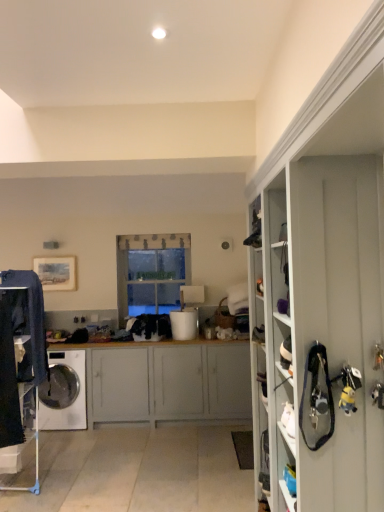
Question: Is white matte cabinet at center spatially inside dark blue denim jeans at left, or outside of it?

Choices:
 (A) inside
 (B) outside

Answer: (B)

Question: In terms of size, does white matte cabinet at center appear bigger or smaller than dark blue denim jeans at left?

Choices:
 (A) big
 (B) small

Answer: (A)

Question: Estimate the real-world distances between objects in this image. Which object is closer to the dark blue denim jeans at left?

Choices:
 (A) white glossy washing machine at lower left
 (B) clear glass window at center
 (C) white matte cabinet at center

Answer: (A)

Question: Based on their relative distances, which object is nearer to the white matte cabinet at center?

Choices:
 (A) clear glass window at center
 (B) white glossy washing machine at lower left
 (C) dark blue denim jeans at left

Answer: (B)